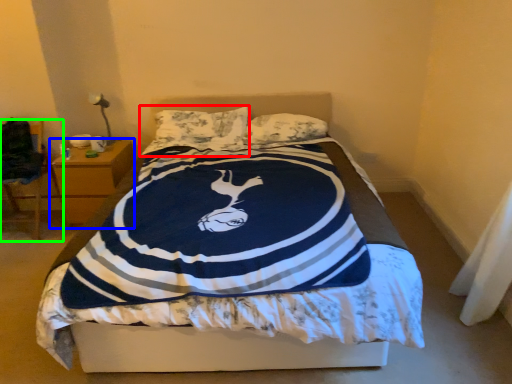
Question: Which object is positioned closest to pillow (highlighted by a red box)? Select from nightstand (highlighted by a blue box) and chair (highlighted by a green box).

Choices:
 (A) nightstand
 (B) chair

Answer: (A)